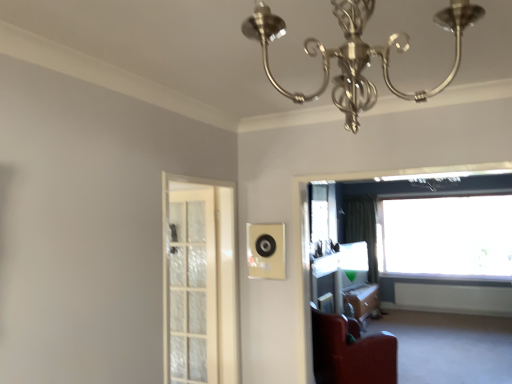
Question: Is transparent glass window at upper right, which is counted as the first window, starting from the front, bigger than wooden table at lower right?

Choices:
 (A) yes
 (B) no

Answer: (A)

Question: Is wooden table at lower right inside transparent glass window at upper right, the 1th window when ordered from left to right?

Choices:
 (A) yes
 (B) no

Answer: (B)

Question: Does transparent glass window at upper right, the 1th window when ordered from left to right, appear on the right side of wooden table at lower right?

Choices:
 (A) yes
 (B) no

Answer: (B)

Question: Does transparent glass window at upper right, placed as the second window when sorted from back to front, lie behind wooden table at lower right?

Choices:
 (A) no
 (B) yes

Answer: (A)

Question: Is transparent glass window at upper right, which is counted as the first window, starting from the front, wider than wooden table at lower right?

Choices:
 (A) no
 (B) yes

Answer: (B)

Question: From a real-world perspective, is green fabric curtain at right physically located above or below clear plastic window screen at right?

Choices:
 (A) above
 (B) below

Answer: (B)

Question: Do you think green fabric curtain at right is within clear plastic window screen at right, or outside of it?

Choices:
 (A) inside
 (B) outside

Answer: (B)

Question: Considering the positions of green fabric curtain at right and clear plastic window screen at right in the image, is green fabric curtain at right wider or thinner than clear plastic window screen at right?

Choices:
 (A) wide
 (B) thin

Answer: (A)

Question: From the image's perspective, is green fabric curtain at right located above or below clear plastic window screen at right?

Choices:
 (A) below
 (B) above

Answer: (A)

Question: Considering the positions of point (457, 261) and point (330, 215), is point (457, 261) closer or farther from the camera than point (330, 215)?

Choices:
 (A) farther
 (B) closer

Answer: (B)

Question: In the image, is transparent glass window at upper right, the 2th window when ordered from left to right, positioned in front of or behind clear plastic window screen at right?

Choices:
 (A) behind
 (B) front

Answer: (A)

Question: Choose the correct answer: Is transparent glass window at upper right, which is the second window in front-to-back order, inside clear plastic window screen at right or outside it?

Choices:
 (A) inside
 (B) outside

Answer: (B)

Question: From their relative heights in the image, would you say transparent glass window at upper right, the first window from the right, is taller or shorter than clear plastic window screen at right?

Choices:
 (A) tall
 (B) short

Answer: (A)

Question: Is clear plastic window screen at right to the left or to the right of transparent glass window at upper right, placed as the second window when sorted from back to front, in the image?

Choices:
 (A) left
 (B) right

Answer: (A)

Question: Relative to transparent glass window at upper right, the 1th window when ordered from left to right, is clear plastic window screen at right in front or behind?

Choices:
 (A) behind
 (B) front

Answer: (A)